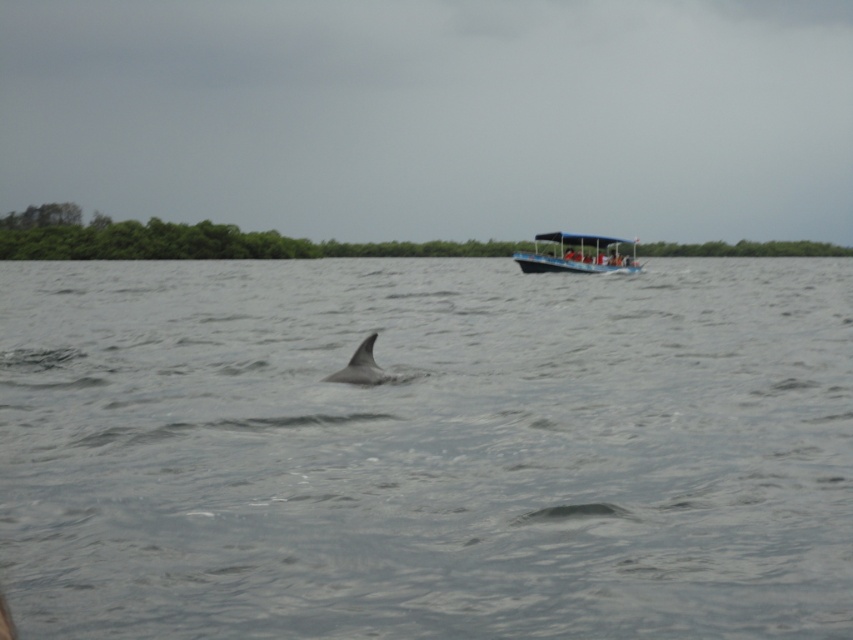
Question: Does gray matte water at center have a smaller size compared to gray matte dolphin at center?

Choices:
 (A) yes
 (B) no

Answer: (B)

Question: Which object appears closest to the camera in this image?

Choices:
 (A) gray matte dolphin at center
 (B) gray matte water at center
 (C) blue plastic boat at upper right

Answer: (B)

Question: Can you confirm if blue plastic boat at upper right is thinner than gray matte dolphin at center?

Choices:
 (A) no
 (B) yes

Answer: (B)

Question: Can you confirm if gray matte water at center is positioned below blue plastic boat at upper right?

Choices:
 (A) yes
 (B) no

Answer: (A)

Question: Which of the following is the closest to the observer?

Choices:
 (A) gray matte dolphin at center
 (B) gray matte water at center
 (C) blue plastic boat at upper right

Answer: (B)

Question: Which point is closer to the camera?

Choices:
 (A) (572, 234)
 (B) (158, 436)
 (C) (339, 372)

Answer: (B)